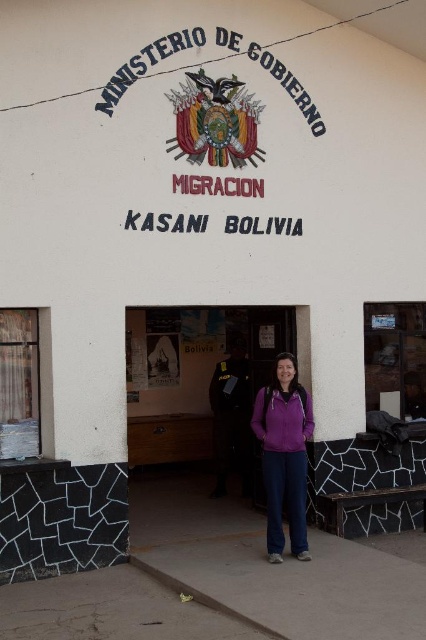
Can you confirm if purple fleece jacket at center is thinner than black leather jacket at center?

In fact, purple fleece jacket at center might be wider than black leather jacket at center.

Is point (287, 362) closer to viewer compared to point (247, 410)?

Yes, point (287, 362) is closer to viewer.

The image size is (426, 640). In order to click on purple fleece jacket at center in this screenshot , I will do `click(284, 456)`.

In the scene shown: Can you confirm if wooden door at center is wider than black leather jacket at center?

Indeed, wooden door at center has a greater width compared to black leather jacket at center.

Is point (181, 435) farther from camera compared to point (247, 400)?

Yes, point (181, 435) is farther from viewer.

Where is `wooden door at center`? This screenshot has height=640, width=426. wooden door at center is located at coordinates (203, 381).

Find the location of a particular element. wooden door at center is located at coordinates (203, 381).

Is wooden door at center to the right of purple fleece jacket at center from the viewer's perspective?

Incorrect, wooden door at center is not on the right side of purple fleece jacket at center.

Who is shorter, wooden door at center or purple fleece jacket at center?

Standing shorter between the two is purple fleece jacket at center.

Which is in front, point (190, 369) or point (270, 412)?

Positioned in front is point (270, 412).

At what (x,y) coordinates should I click in order to perform the action: click on wooden door at center. Please return your answer as a coordinate pair (x, y). This screenshot has height=640, width=426. Looking at the image, I should click on (203, 381).